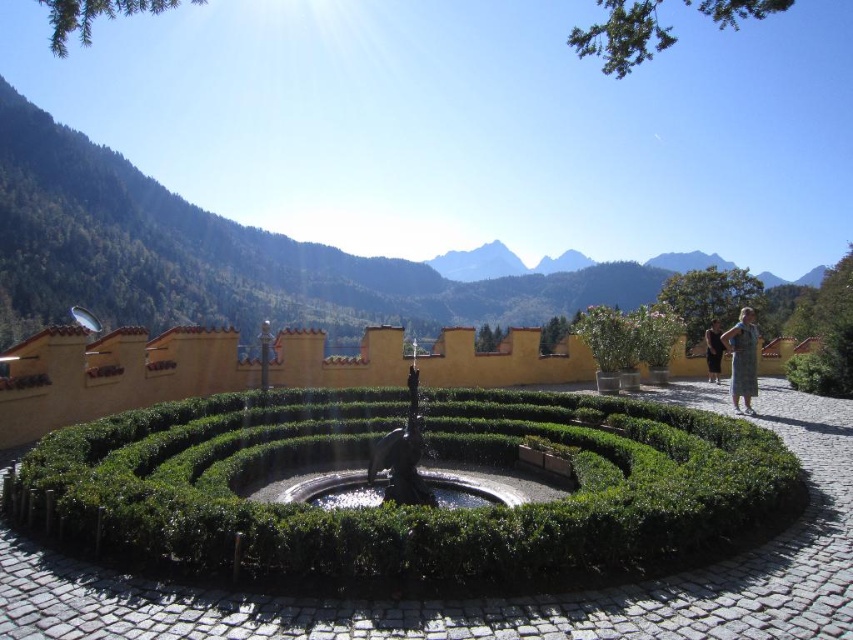
Question: Can you confirm if green forested mountain at upper center is positioned to the left of green leafy bush at upper right?

Choices:
 (A) no
 (B) yes

Answer: (B)

Question: Among these points, which one is nearest to the camera?

Choices:
 (A) (709, 358)
 (B) (395, 428)

Answer: (B)

Question: Which is nearer to the dark blue fabric dress at right?

Choices:
 (A) green leafy hedge at center
 (B) bronze statue at center
 (C) green dress at right
 (D) green leafy bush at upper right

Answer: (D)

Question: Considering the real-world distances, which object is farthest from the dark blue fabric dress at right?

Choices:
 (A) green leafy bush at upper right
 (B) bronze statue at center
 (C) green forested mountain at upper center
 (D) green dress at right

Answer: (C)

Question: Is green forested mountain at upper center below green leafy bush at upper right?

Choices:
 (A) yes
 (B) no

Answer: (B)

Question: Considering the relative positions of green leafy hedge at center and green dress at right in the image provided, where is green leafy hedge at center located with respect to green dress at right?

Choices:
 (A) below
 (B) above

Answer: (A)